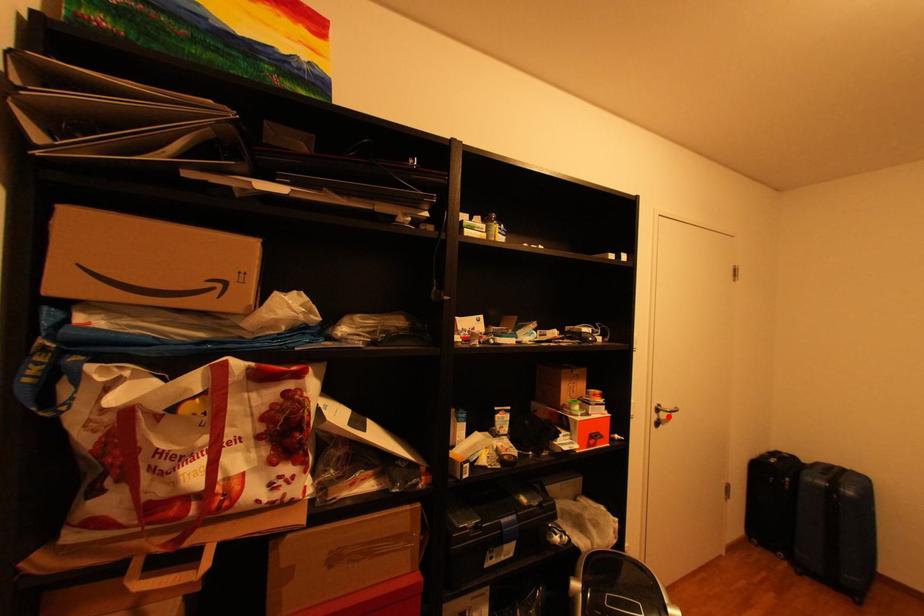
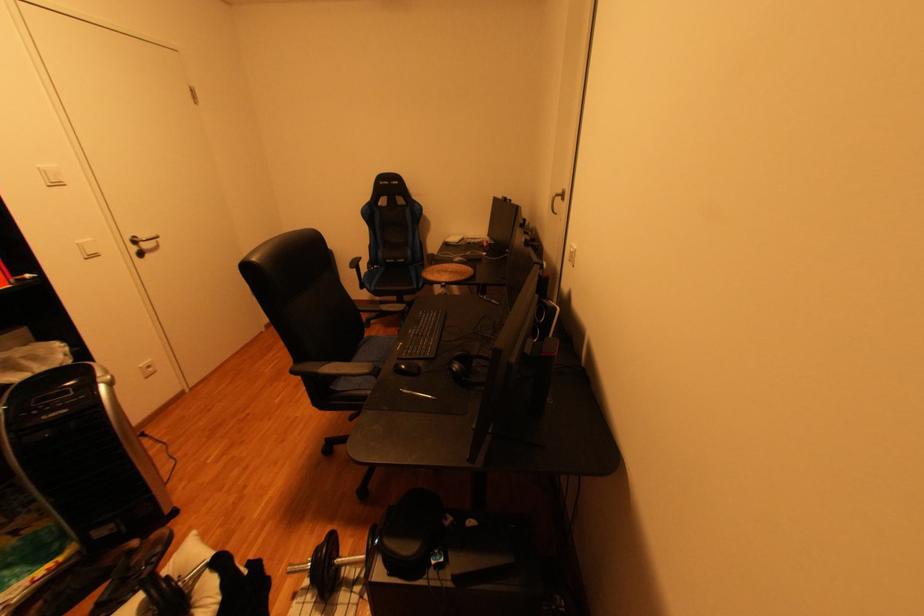
Find the pixel in the second image that matches the highlighted location in the first image.

(150, 248)